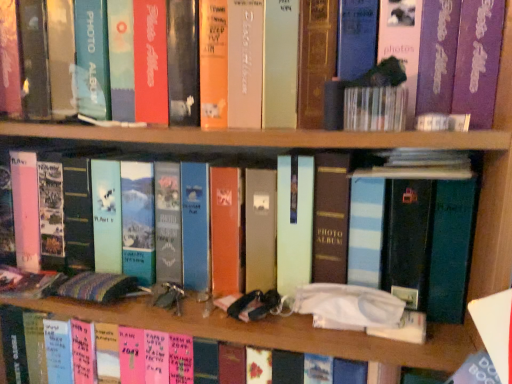
Question: Is white matte tissue box at center, which is the second book in top-to-bottom order, bigger or smaller than blue striped photo album at center, the first book in the top-to-bottom sequence?

Choices:
 (A) big
 (B) small

Answer: (A)

Question: Relative to blue striped photo album at center, the first book in the top-to-bottom sequence, is white matte tissue box at center, arranged as the first book when ordered from the bottom, in front or behind?

Choices:
 (A) front
 (B) behind

Answer: (B)

Question: Is white matte tissue box at center, which is the second book in top-to-bottom order, taller or shorter than blue striped photo album at center, the first book in the top-to-bottom sequence?

Choices:
 (A) short
 (B) tall

Answer: (B)

Question: In terms of height, does blue striped photo album at center, the 2th book from the bottom, look taller or shorter compared to white matte tissue box at center, which is the second book in top-to-bottom order?

Choices:
 (A) tall
 (B) short

Answer: (B)

Question: Is blue striped photo album at center, the first book in the top-to-bottom sequence, bigger or smaller than white matte tissue box at center, which is the second book in top-to-bottom order?

Choices:
 (A) small
 (B) big

Answer: (A)

Question: Is blue striped photo album at center, the 2th book from the bottom, inside the boundaries of white matte tissue box at center, arranged as the first book when ordered from the bottom, or outside?

Choices:
 (A) inside
 (B) outside

Answer: (B)

Question: Considering the positions of point (401, 283) and point (386, 339), is point (401, 283) closer or farther from the camera than point (386, 339)?

Choices:
 (A) farther
 (B) closer

Answer: (A)